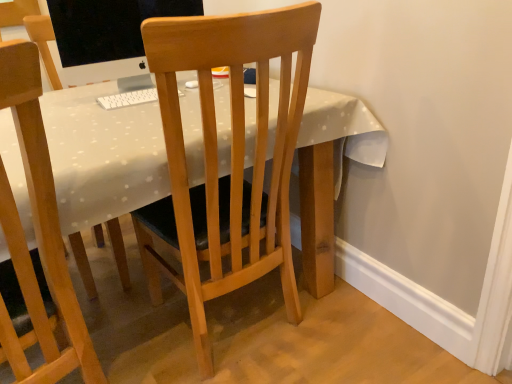
Question: From a real-world perspective, is light wood chair at center, which appears as the second chair when viewed from the left, over wooden desk at center?

Choices:
 (A) no
 (B) yes

Answer: (B)

Question: Is light wood chair at center, which appears as the second chair when viewed from the left, outside of wooden desk at center?

Choices:
 (A) no
 (B) yes

Answer: (A)

Question: Is light wood chair at center, which appears as the second chair when viewed from the left, surrounding wooden desk at center?

Choices:
 (A) yes
 (B) no

Answer: (B)

Question: Is light wood chair at center, which appears as the second chair when viewed from the left, positioned with its back to wooden desk at center?

Choices:
 (A) no
 (B) yes

Answer: (B)

Question: Does light wood chair at center, which is the first chair from right to left, have a smaller size compared to wooden desk at center?

Choices:
 (A) no
 (B) yes

Answer: (B)

Question: From a real-world perspective, is wooden desk at center positioned above or below matte black monitor at upper left?

Choices:
 (A) below
 (B) above

Answer: (A)

Question: From the image's perspective, relative to matte black monitor at upper left, is wooden desk at center above or below?

Choices:
 (A) above
 (B) below

Answer: (B)

Question: Considering the positions of wooden desk at center and matte black monitor at upper left in the image, is wooden desk at center taller or shorter than matte black monitor at upper left?

Choices:
 (A) short
 (B) tall

Answer: (B)

Question: Does point (60, 107) appear closer or farther from the camera than point (95, 3)?

Choices:
 (A) farther
 (B) closer

Answer: (A)

Question: Would you say wooden chair at center, placed as the first chair when sorted from left to right, is to the left or to the right of wooden desk at center in the picture?

Choices:
 (A) right
 (B) left

Answer: (B)

Question: From a real-world perspective, relative to wooden desk at center, is wooden chair at center, placed as the first chair when sorted from left to right, vertically above or below?

Choices:
 (A) below
 (B) above

Answer: (B)

Question: From the image's perspective, is wooden chair at center, the 2th chair viewed from the right, located above or below wooden desk at center?

Choices:
 (A) above
 (B) below

Answer: (B)

Question: Is wooden chair at center, the 2th chair viewed from the right, inside the boundaries of wooden desk at center, or outside?

Choices:
 (A) inside
 (B) outside

Answer: (A)

Question: Based on their sizes in the image, would you say wooden desk at center is bigger or smaller than light wood chair at center, which is the first chair from right to left?

Choices:
 (A) big
 (B) small

Answer: (A)

Question: Choose the correct answer: Is wooden desk at center inside light wood chair at center, which appears as the second chair when viewed from the left, or outside it?

Choices:
 (A) outside
 (B) inside

Answer: (A)